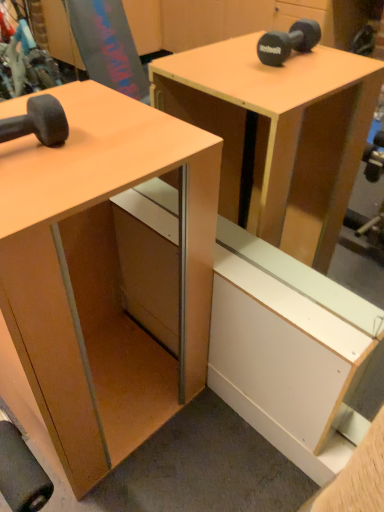
Locate an element on the screen. The image size is (384, 512). empty space that is ontop of matte wood desk at left is located at coordinates (76, 142).